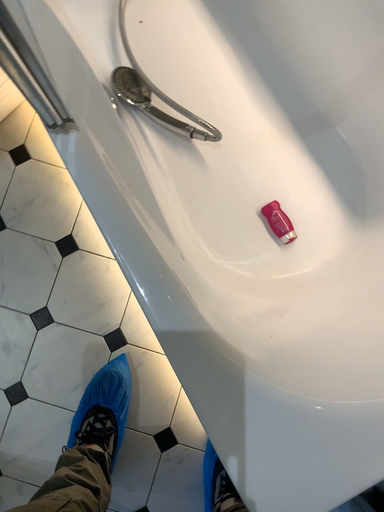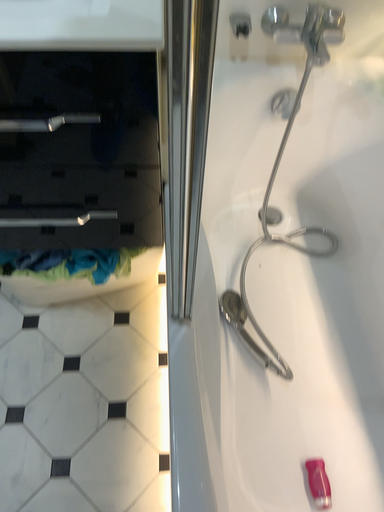
Question: Which way did the camera rotate in the video?

Choices:
 (A) rotated upward
 (B) rotated downward

Answer: (A)